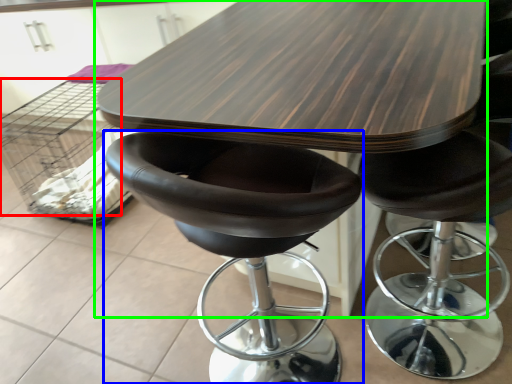
Question: Which object is positioned farthest from crate (highlighted by a red box)? Select from chair (highlighted by a blue box) and table (highlighted by a green box).

Choices:
 (A) chair
 (B) table

Answer: (A)